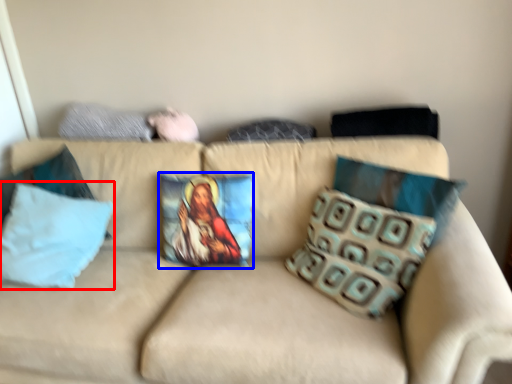
Question: Among these objects, which one is nearest to the camera, pillow (highlighted by a red box) or pillow (highlighted by a blue box)?

Choices:
 (A) pillow
 (B) pillow

Answer: (A)